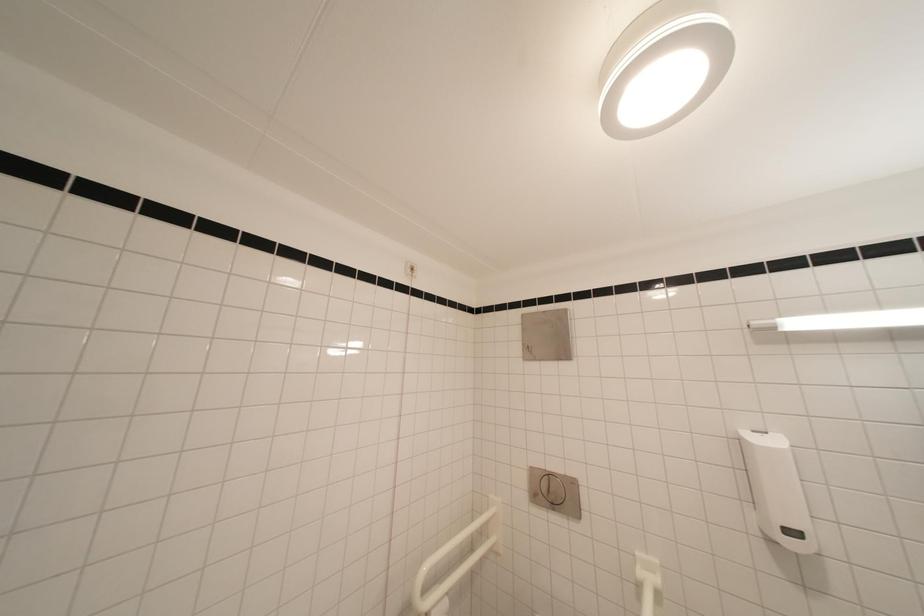
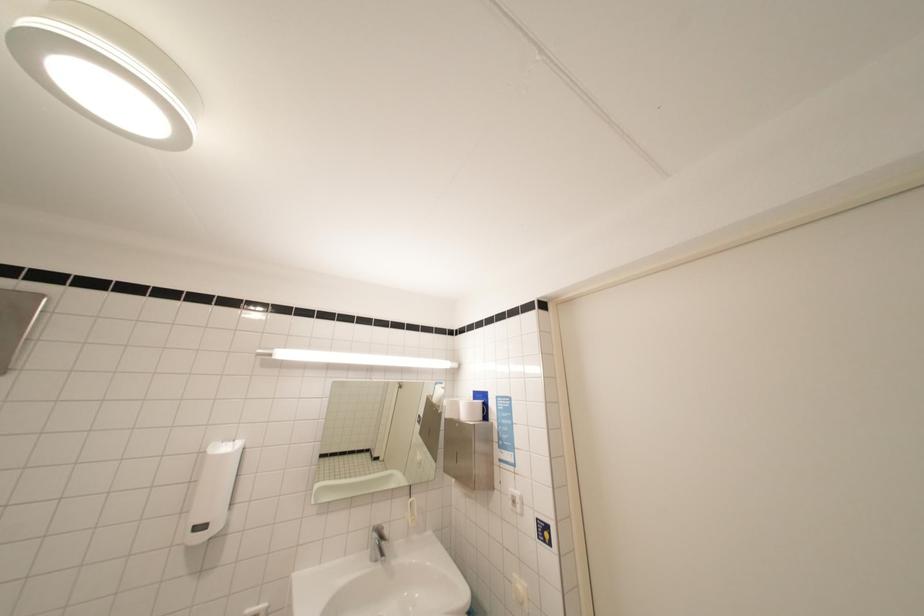
Question: How did the camera likely rotate?

Choices:
 (A) Left
 (B) Right
 (C) Up
 (D) Down

Answer: (B)